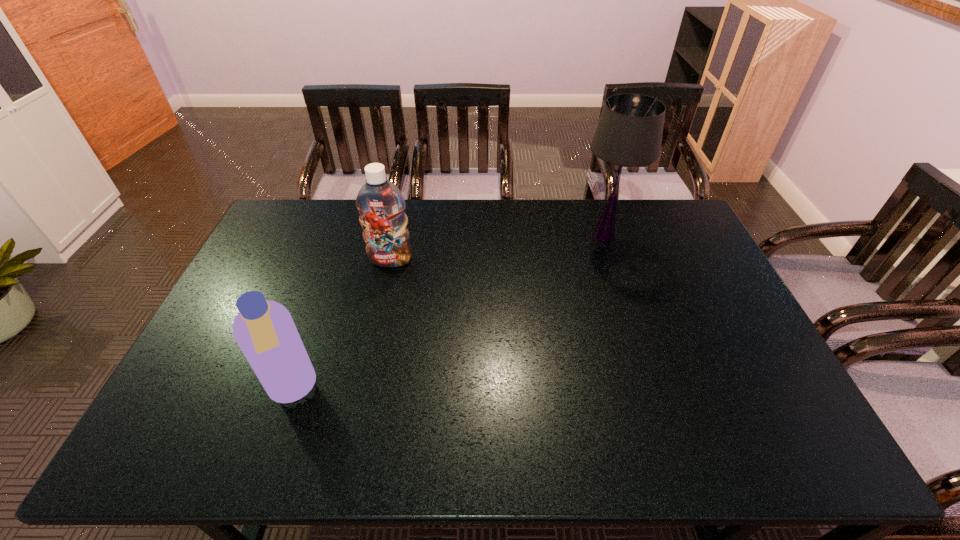
You are a GUI agent. You are given a task and a screenshot of the screen. Output one action in this format:
    pyautogui.click(x=<x>, y=<y>)
    Task: Click on the vacant space located 0.080m on the front of the nearest object
    Image resolution: width=960 pixels, height=540 pixels.
    Given the screenshot: What is the action you would take?
    pyautogui.click(x=271, y=449)

The width and height of the screenshot is (960, 540). I want to click on object that is at the far edge, so click(629, 132).

The image size is (960, 540). What are the coordinates of `free space at the far edge` in the screenshot? It's located at (536, 210).

Find the location of `vacant space at the near edge`. vacant space at the near edge is located at coordinates (455, 448).

This screenshot has width=960, height=540. In order to click on free region at the right edge of the desktop in this screenshot , I will do `click(706, 327)`.

This screenshot has height=540, width=960. In order to click on free space at the far left corner in this screenshot , I will do `click(276, 214)`.

This screenshot has width=960, height=540. Find the location of `free point between the rightmost object and the second object from right to left`. free point between the rightmost object and the second object from right to left is located at coordinates (497, 248).

Where is `free area in between the second object from left to right and the rightmost object`? The image size is (960, 540). free area in between the second object from left to right and the rightmost object is located at coordinates coord(497,248).

Where is `vacant area that lies between the leftmost object and the tallest object`? Image resolution: width=960 pixels, height=540 pixels. vacant area that lies between the leftmost object and the tallest object is located at coordinates (448, 313).

In order to click on free space between the nearest object and the farther shampoo in this screenshot , I will do `click(341, 325)`.